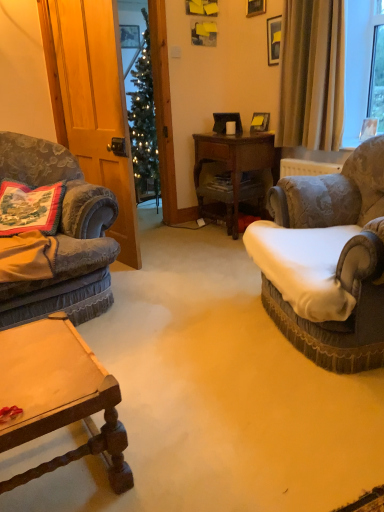
Locate an element on the screen. The image size is (384, 512). vacant space that's between velvet fabric armchair at left, arranged as the second chair when viewed from the right, and velvet-patterned armchair at right, which is the second chair from left to right is located at coordinates (188, 311).